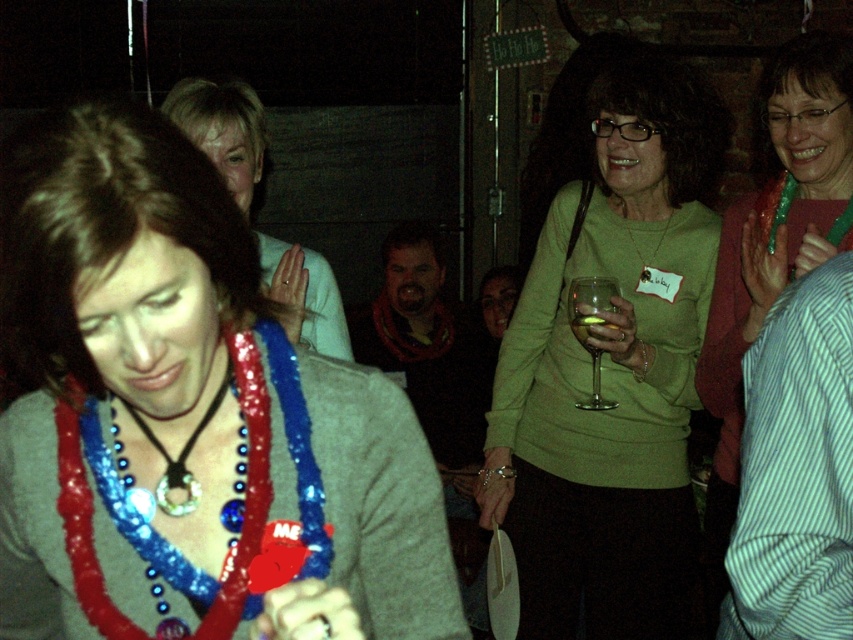
You are at a party and want to choose a necklace to wear. You have two options in front of you. The green shiny necklace at upper right and the shiny plastic necklace at center. Which one is larger?

The green shiny necklace at upper right is bigger than the shiny plastic necklace at center.

You are at a party and want to find the green shiny necklace at upper right. According to the coordinates provided, where should you look in the image?

The green shiny necklace at upper right is located at coordinates point (773, 246).

You are at a party and see two necklaces. The green shiny necklace at upper right and the shiny plastic necklace at center. Which necklace is closer to the bottom?

The green shiny necklace at upper right is positioned under the shiny plastic necklace at center, so it is closer to the bottom.